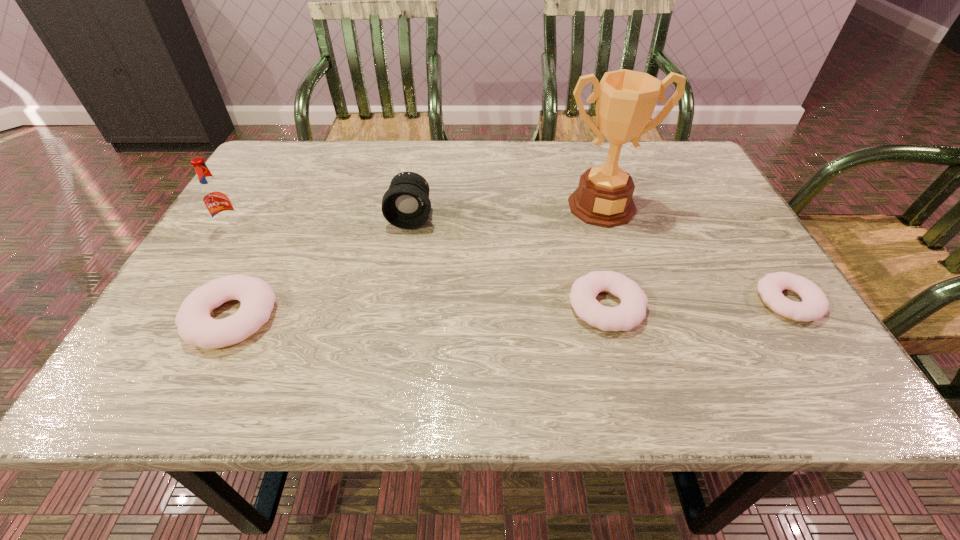
If the aim is uniform spacing by inserting an additional doughnut among them, please point to a vacant space for this new doughnut. Please provide its 2D coordinates. Your answer should be formatted as a tuple, i.e. [(x, y)], where the tuple contains the x and y coordinates of a point satisfying the conditions above.

[(421, 312)]